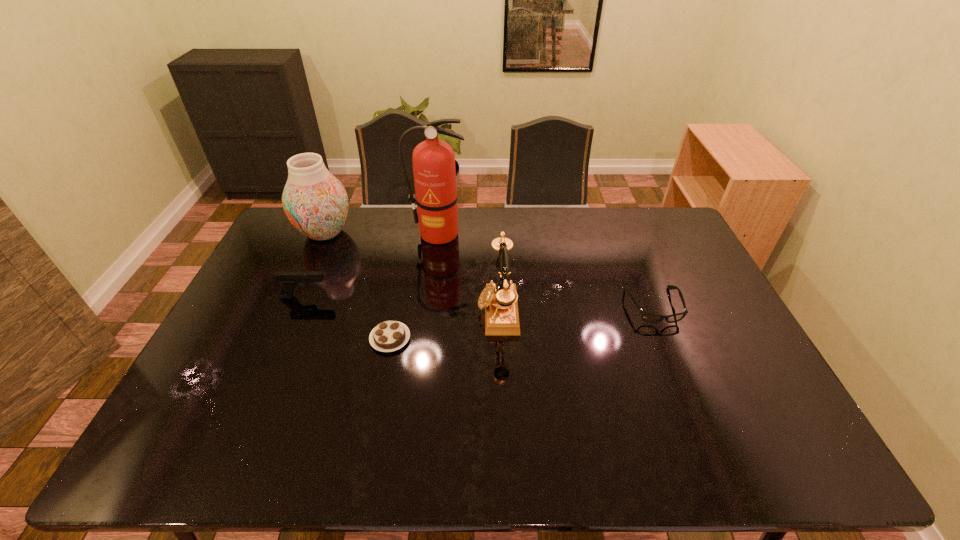
At what (x,y) coordinates should I click in order to perform the action: click on empty space between the shortest object and the tallest object. Please return your answer as a coordinate pair (x, y). Image resolution: width=960 pixels, height=540 pixels. Looking at the image, I should click on (414, 286).

Locate an element on the screen. unoccupied area between the rightmost object and the chocolate cake is located at coordinates (522, 322).

Image resolution: width=960 pixels, height=540 pixels. Find the location of `vacant area that lies between the fire extinguisher and the telephone`. vacant area that lies between the fire extinguisher and the telephone is located at coordinates click(468, 272).

This screenshot has height=540, width=960. Identify the location of unoccupied position between the fourth tallest object and the vase. (315, 265).

Identify the location of free space that is in between the telephone and the vase. (412, 272).

At what (x,y) coordinates should I click in order to perform the action: click on vacant space that is in between the tallest object and the spectacles. Please return your answer as a coordinate pair (x, y). The image size is (960, 540). Looking at the image, I should click on (546, 270).

This screenshot has height=540, width=960. In order to click on free space that is in between the pistol and the telephone in this screenshot , I will do `click(401, 303)`.

The width and height of the screenshot is (960, 540). I want to click on object that ranks as the closest to the tallest object, so click(499, 299).

This screenshot has width=960, height=540. I want to click on object that is the fourth closest one to the spectacles, so click(x=289, y=280).

Identify the location of free spot that satisfies the following two spatial constraints: 1. on the dial of the telephone; 2. on the front side of the chocolate cake. The width and height of the screenshot is (960, 540). (499, 339).